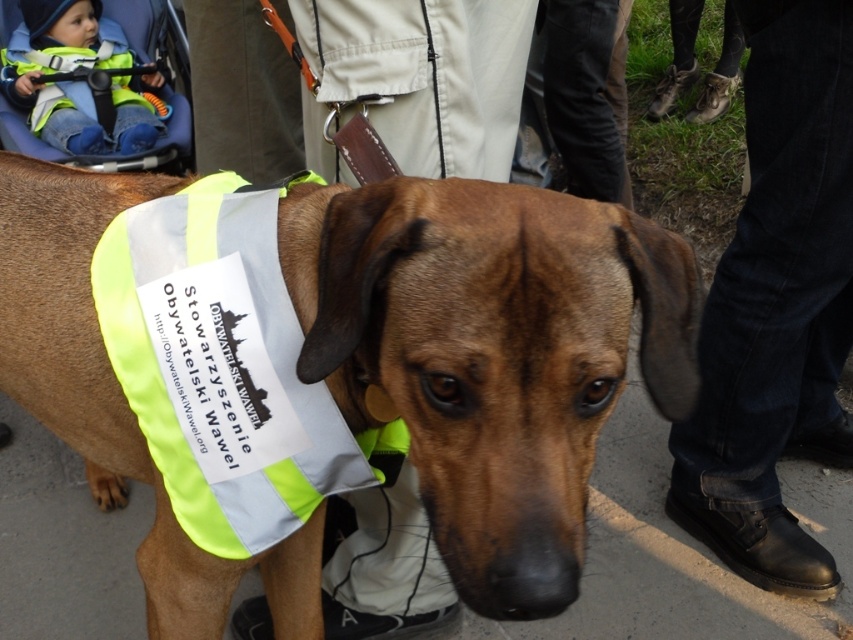
You are a photographer taking a picture of the neon yellow fabric safety vest at center and the jeans at lower right. Which object is located more to the right side of the image?

The jeans at lower right is positioned on the right side of neon yellow fabric safety vest at center, so the jeans at lower right is more to the right side of the image.